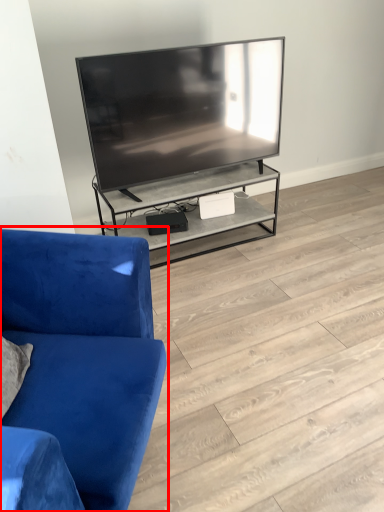
Question: From the image, what is the correct spatial relationship of studio couch (annotated by the red box) in relation to tile?

Choices:
 (A) left
 (B) right

Answer: (A)